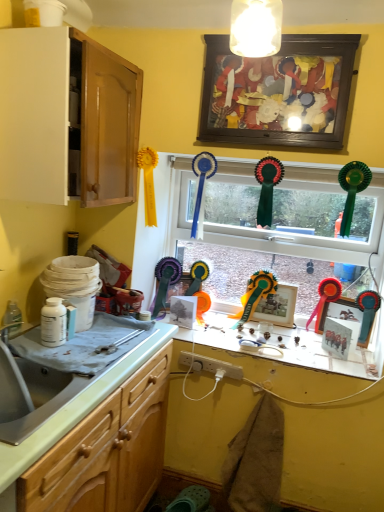
Locate an element on the screen. The image size is (384, 512). space that is in front of matte paper picture frame at center, the third picture frame in the bottom-to-top sequence is located at coordinates (195, 337).